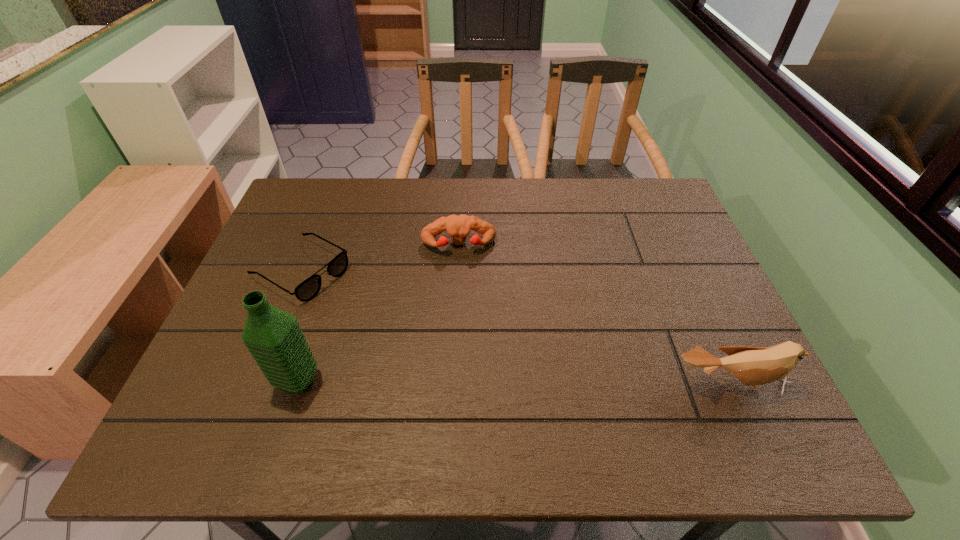
You are a GUI agent. You are given a task and a screenshot of the screen. Output one action in this format:
    pyautogui.click(x=<x>, y=<y>)
    Task: Click on the free space between the second shortest object and the water bottle
    
    Given the screenshot: What is the action you would take?
    pyautogui.click(x=378, y=313)

Image resolution: width=960 pixels, height=540 pixels. Find the location of `the second closest object to the shortest object`. the second closest object to the shortest object is located at coordinates (458, 227).

This screenshot has width=960, height=540. Find the location of `object that is the third closest to the third tallest object`. object that is the third closest to the third tallest object is located at coordinates (753, 366).

The image size is (960, 540). I want to click on vacant point that satisfies the following two spatial constraints: 1. on the back side of the second object from right to left; 2. on the left side of the shortest object, so click(311, 245).